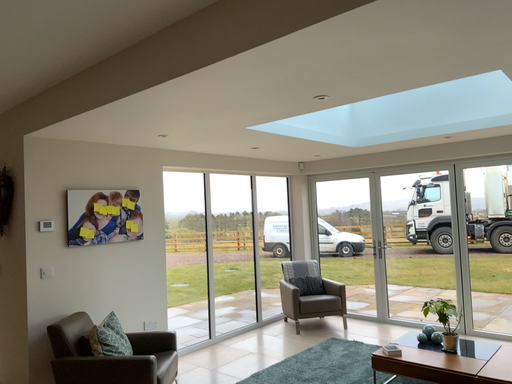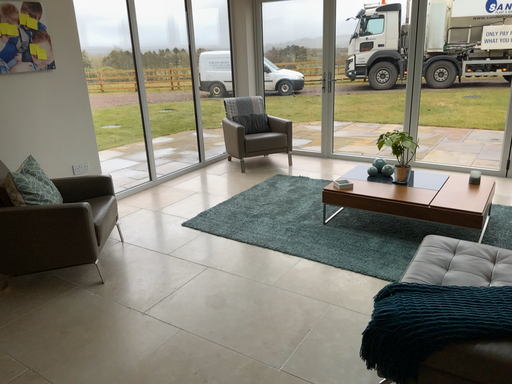
Question: Which way did the camera rotate in the video?

Choices:
 (A) rotated left
 (B) rotated right

Answer: (B)